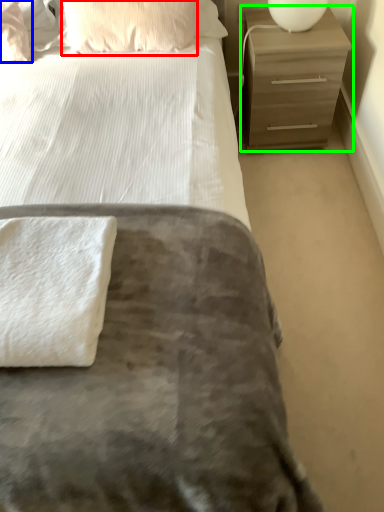
Question: Which is nearer to the pillow (highlighted by a red box)? pillow (highlighted by a blue box) or chest of drawers (highlighted by a green box).

Choices:
 (A) pillow
 (B) chest of drawers

Answer: (A)